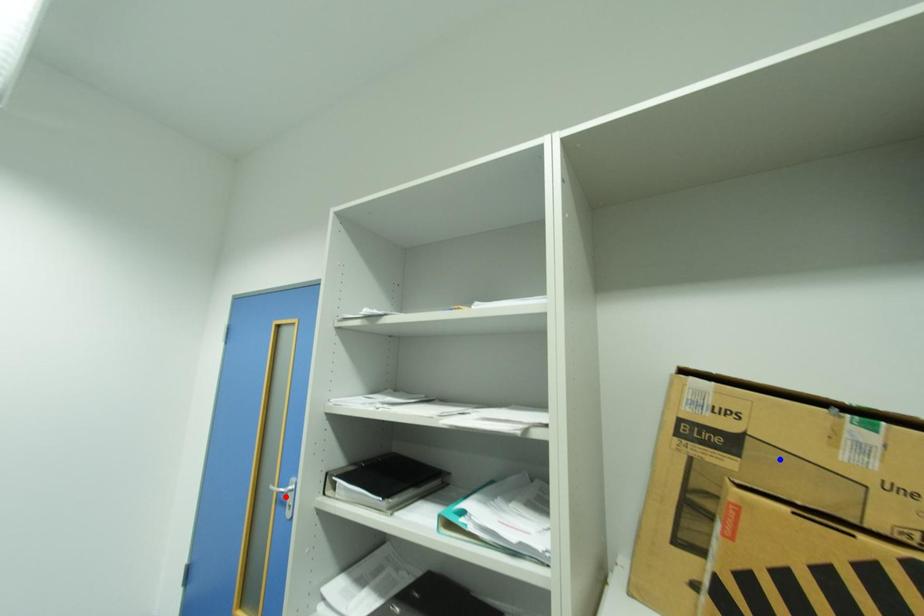
Question: In the image, two points are highlighted. Which point is nearer to the camera? Reply with the corresponding letter.

Choices:
 (A) blue point
 (B) red point

Answer: (A)